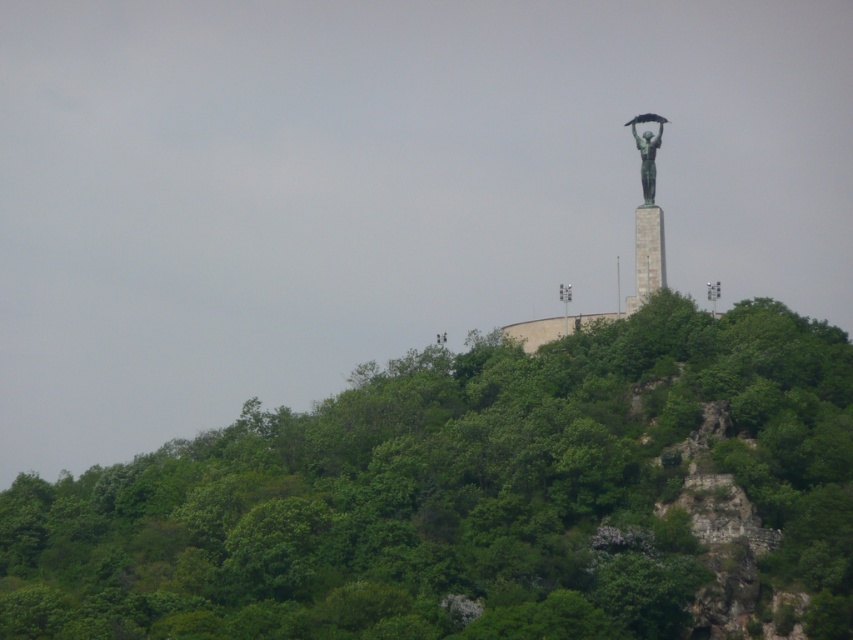
Question: Which point is closer to the camera?

Choices:
 (A) bronze statue at upper center
 (B) green patina statue at upper center
 (C) gray metallic lamp post at upper center
 (D) green leafy trees at upper center

Answer: (D)

Question: Can you confirm if green patina statue at upper center is positioned above gray metallic lamp post at upper center?

Choices:
 (A) no
 (B) yes

Answer: (B)

Question: Can you confirm if metallic gray lamp post at upper center is positioned to the left of gray metallic lamp post at upper center?

Choices:
 (A) no
 (B) yes

Answer: (B)

Question: Which point is closer to the camera?

Choices:
 (A) green leafy trees at upper center
 (B) bronze statue at upper center

Answer: (A)

Question: Which point is farther from the camera taking this photo?

Choices:
 (A) (656, 218)
 (B) (653, 237)
 (C) (564, 323)

Answer: (A)

Question: Can you confirm if green leafy trees at upper center is positioned to the left of bronze statue at upper center?

Choices:
 (A) yes
 (B) no

Answer: (A)